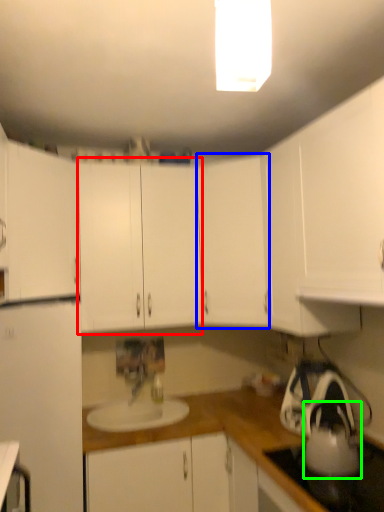
Question: Which object is positioned closest to cabinetry (highlighted by a red box)? Select from cabinetry (highlighted by a blue box) and tea pot (highlighted by a green box).

Choices:
 (A) cabinetry
 (B) tea pot

Answer: (A)